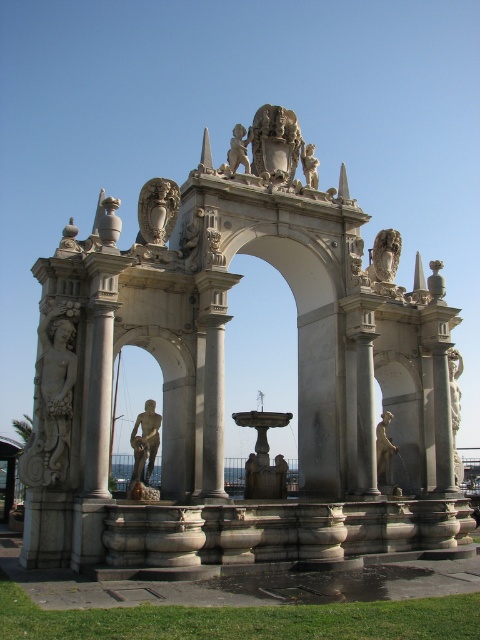
In the scene shown: You are standing in front of the grand archway and want to locate the carved stone figure at left. Where exactly is it positioned relative to the archway?

The carved stone figure at left is positioned at point 0.623 on the x axis and 0.110 on the y axis relative to the archway.

You are an art student standing in front of the grand stone archway. You notice two statues here. Which one is closer to you, the carved stone figure at left or the white marble statue at right?

The carved stone figure at left is closer to you because it is in front of the white marble statue at right.